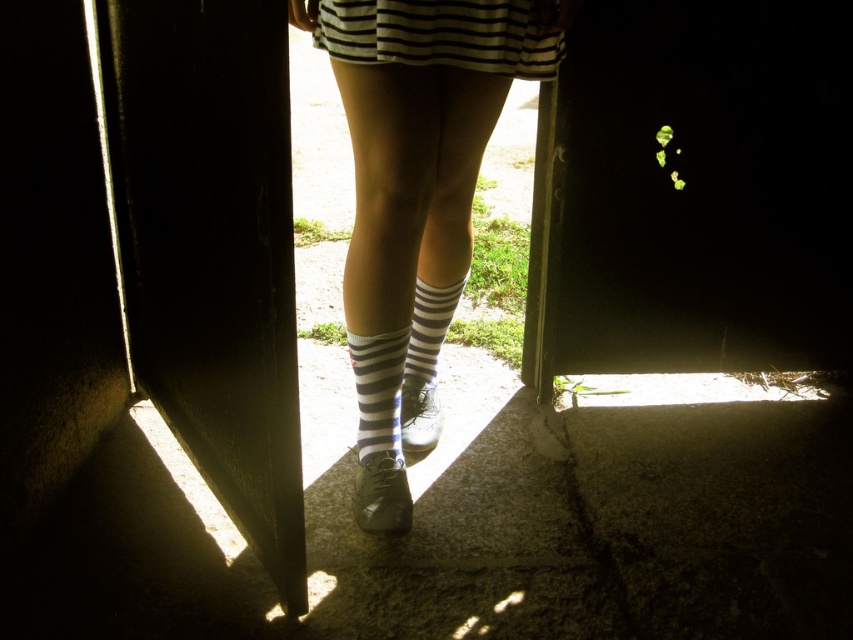
Which is behind, point (621, 221) or point (370, 394)?

The point (621, 221) is behind.

Which is more to the left, black matte door at center or striped cotton sock at center?

striped cotton sock at center is more to the left.

Is point (624, 26) more distant than point (397, 444)?

That is True.

Where is `black matte door at center`? Image resolution: width=853 pixels, height=640 pixels. black matte door at center is located at coordinates (693, 192).

Between white striped socks at center and striped cotton socks at center, which one is positioned higher?

white striped socks at center is above.

Can you confirm if white striped socks at center is positioned above striped cotton socks at center?

Yes, white striped socks at center is above striped cotton socks at center.

Is point (386, 248) positioned in front of point (421, 324)?

That is True.

The height and width of the screenshot is (640, 853). Find the location of `white striped socks at center`. white striped socks at center is located at coordinates (415, 196).

Image resolution: width=853 pixels, height=640 pixels. I want to click on striped cotton sock at center, so click(x=378, y=388).

Who is positioned more to the left, striped cotton sock at center or striped cotton socks at center?

From the viewer's perspective, striped cotton sock at center appears more on the left side.

Between point (396, 451) and point (421, 300), which one is positioned in front?

Positioned in front is point (396, 451).

Find the location of `striped cotton sock at center`. striped cotton sock at center is located at coordinates (378, 388).